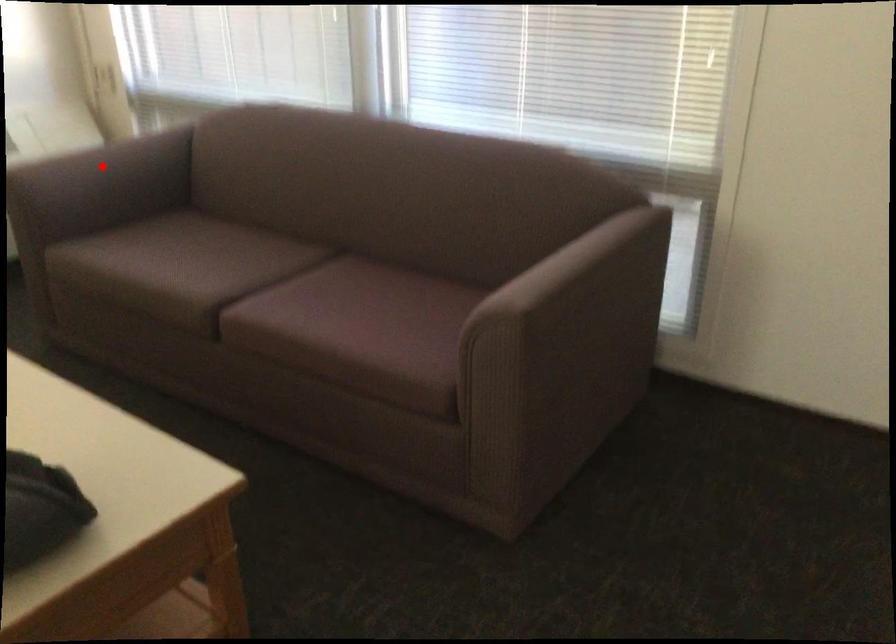
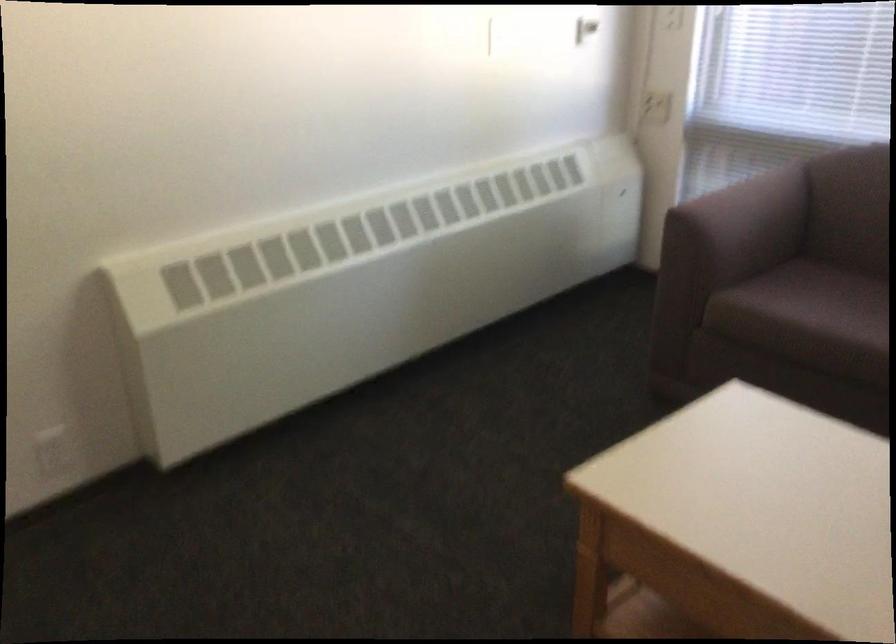
Where in the second image is the point corresponding to the highlighted location from the first image?

(752, 207)